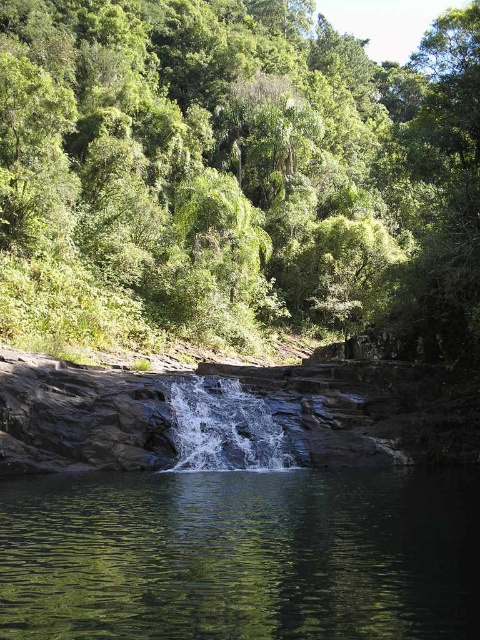
You are standing at the base of the waterfall and want to take a photo of both the green leafy tree at upper center and the green reflective water at center. Which object should you adjust your camera to focus on first if you want to include both in the same frame?

The green leafy tree at upper center is positioned on the right side of green reflective water at center, so you should focus on the green reflective water at center first to ensure both are in the frame.

You are a hiker standing at the base of the waterfall. You see the green leafy tree at upper center and the white frothy water at center. Which object is located to the right of the other?

The green leafy tree at upper center is positioned on the right side of white frothy water at center, so the green leafy tree at upper center is to the right of the white frothy water at center.